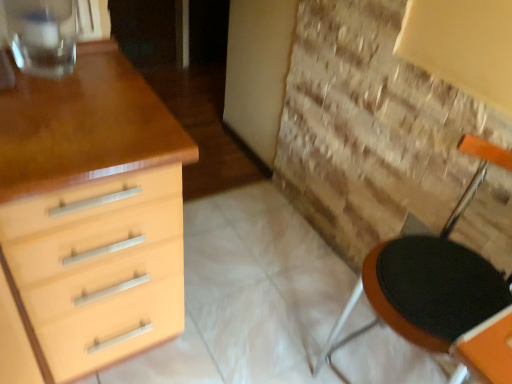
Question: From a real-world perspective, is matte wood chest of drawers at left located beneath transparent glass at upper left?

Choices:
 (A) no
 (B) yes

Answer: (B)

Question: Is the depth of matte wood chest of drawers at left greater than that of transparent glass at upper left?

Choices:
 (A) no
 (B) yes

Answer: (A)

Question: Is matte wood chest of drawers at left smaller than transparent glass at upper left?

Choices:
 (A) no
 (B) yes

Answer: (A)

Question: Would you say matte wood chest of drawers at left is a long distance from transparent glass at upper left?

Choices:
 (A) no
 (B) yes

Answer: (A)

Question: Is matte wood chest of drawers at left closer to camera compared to transparent glass at upper left?

Choices:
 (A) no
 (B) yes

Answer: (B)

Question: Is black fabric armchair at right in front of or behind transparent glass at upper left in the image?

Choices:
 (A) front
 (B) behind

Answer: (A)

Question: Is point (440, 246) positioned closer to the camera than point (9, 1)?

Choices:
 (A) closer
 (B) farther

Answer: (B)

Question: Considering the relative positions of black fabric armchair at right and transparent glass at upper left in the image provided, is black fabric armchair at right to the left or to the right of transparent glass at upper left?

Choices:
 (A) left
 (B) right

Answer: (B)

Question: Is black fabric armchair at right bigger or smaller than transparent glass at upper left?

Choices:
 (A) big
 (B) small

Answer: (A)

Question: Is transparent glass at upper left taller or shorter than matte wood chest of drawers at left?

Choices:
 (A) tall
 (B) short

Answer: (B)

Question: From a real-world perspective, is transparent glass at upper left above or below matte wood chest of drawers at left?

Choices:
 (A) above
 (B) below

Answer: (A)

Question: Considering the positions of point (73, 67) and point (47, 238), is point (73, 67) closer or farther from the camera than point (47, 238)?

Choices:
 (A) farther
 (B) closer

Answer: (A)

Question: Based on their sizes in the image, would you say transparent glass at upper left is bigger or smaller than matte wood chest of drawers at left?

Choices:
 (A) big
 (B) small

Answer: (B)

Question: Does point (105, 337) appear closer or farther from the camera than point (466, 286)?

Choices:
 (A) closer
 (B) farther

Answer: (B)

Question: Is matte wood chest of drawers at left spatially inside black fabric armchair at right, or outside of it?

Choices:
 (A) inside
 (B) outside

Answer: (B)